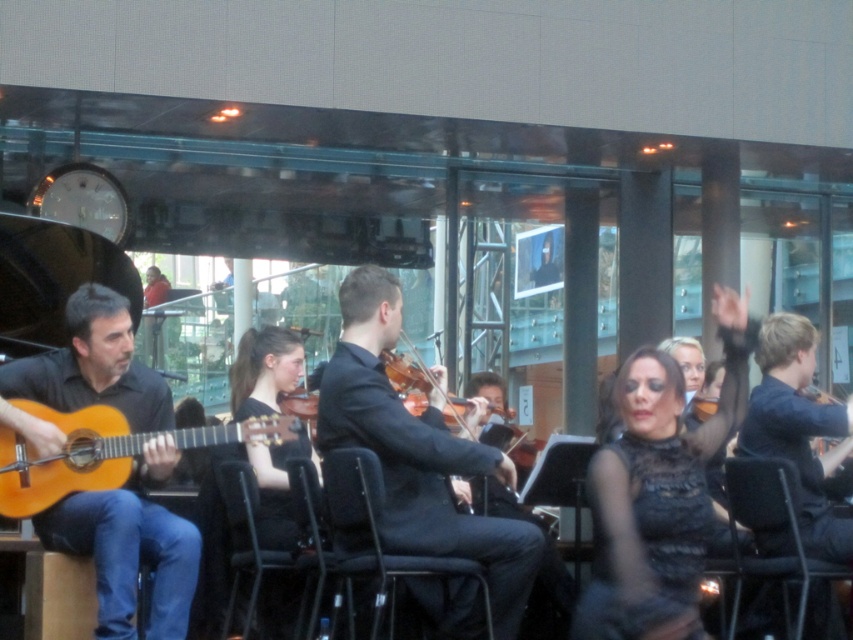
You are a stagehand who needs to move the black smooth suit at center and the black fabric chair at center closer together for the next performance. How much space is between them currently?

The black smooth suit at center and black fabric chair at center are 25.83 centimeters apart, so you need to move them closer to reduce the distance between them.

You are a photographer standing at the back of the concert hall. You want to take a photo of the matte black guitar at left and the wooden violin at center. Which object should you focus on first to ensure both are in sharp focus?

The matte black guitar at left is closer to the viewer than the wooden violin at center, so you should focus on the matte black guitar at left first to ensure both are in sharp focus.

You are a stagehand setting up a microphone stand for the guitarist. The microphone stand is currently at point 0.872, 0.151. Is the matte black guitar at left in the way of placing the microphone stand there?

The matte black guitar at left is located at point (128, 557), so yes, the guitar is exactly at that point and would be in the way of placing the microphone stand there.